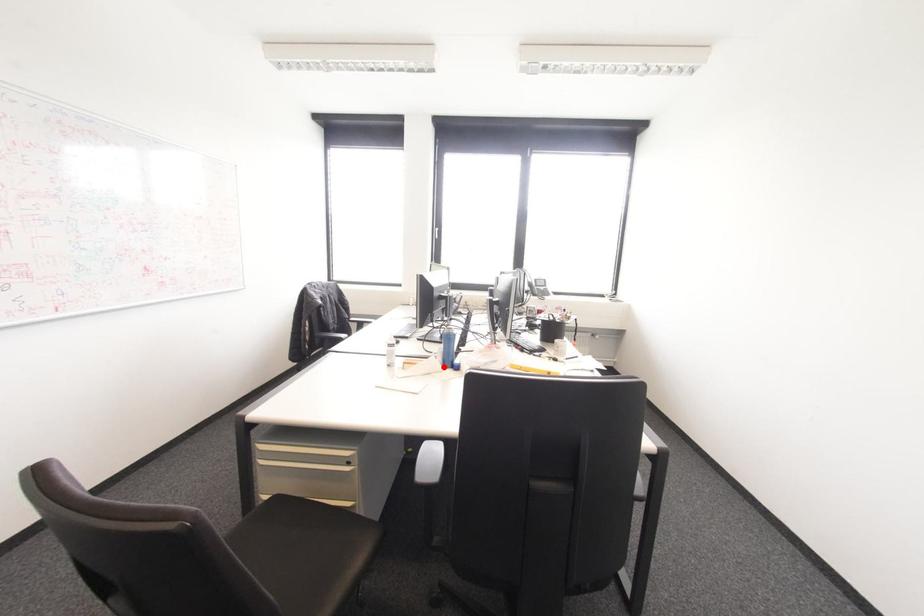
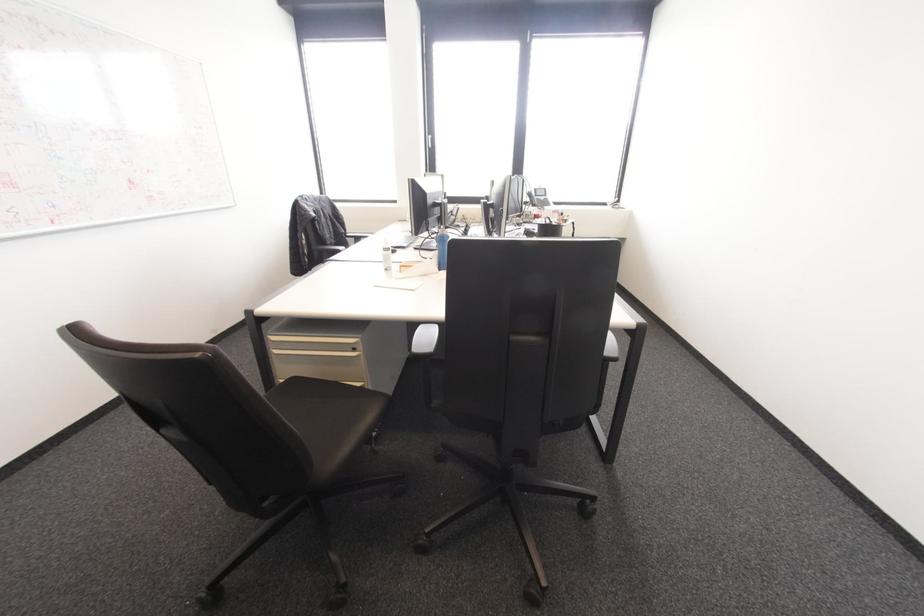
Question: I am providing you with two images of the same scene from different viewpoints. A red point is shown in image1. For the corresponding object point in image2, is it positioned nearer or farther from the camera?

Choices:
 (A) Nearer
 (B) Farther

Answer: (A)